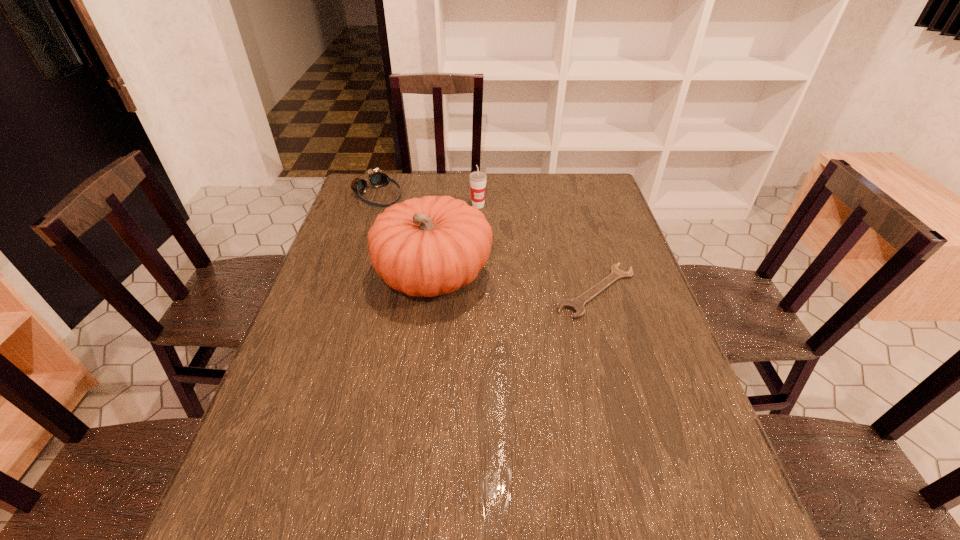
In order to click on vacant space that satisfies the following two spatial constraints: 1. on the front side of the rightmost object; 2. on the right side of the second tallest object in this screenshot , I will do `click(478, 291)`.

Locate an element on the screen. free space that satisfies the following two spatial constraints: 1. on the front side of the goggles; 2. on the left side of the tallest object is located at coordinates (351, 276).

You are a GUI agent. You are given a task and a screenshot of the screen. Output one action in this format:
    pyautogui.click(x=<x>, y=<y>)
    Task: Click on the free point that satisfies the following two spatial constraints: 1. on the front side of the shortest object; 2. on the left side of the third shortest object
    
    Given the screenshot: What is the action you would take?
    478,291

Where is `free location that satisfies the following two spatial constraints: 1. on the back side of the pumpkin; 2. on the right side of the cup`? The image size is (960, 540). free location that satisfies the following two spatial constraints: 1. on the back side of the pumpkin; 2. on the right side of the cup is located at coordinates coord(442,206).

Find the location of a particular element. The image size is (960, 540). vacant space that satisfies the following two spatial constraints: 1. on the front side of the third tallest object; 2. on the left side of the cup is located at coordinates (374, 206).

Locate an element on the screen. This screenshot has height=540, width=960. free location that satisfies the following two spatial constraints: 1. on the front side of the shortest object; 2. on the right side of the second tallest object is located at coordinates (478, 291).